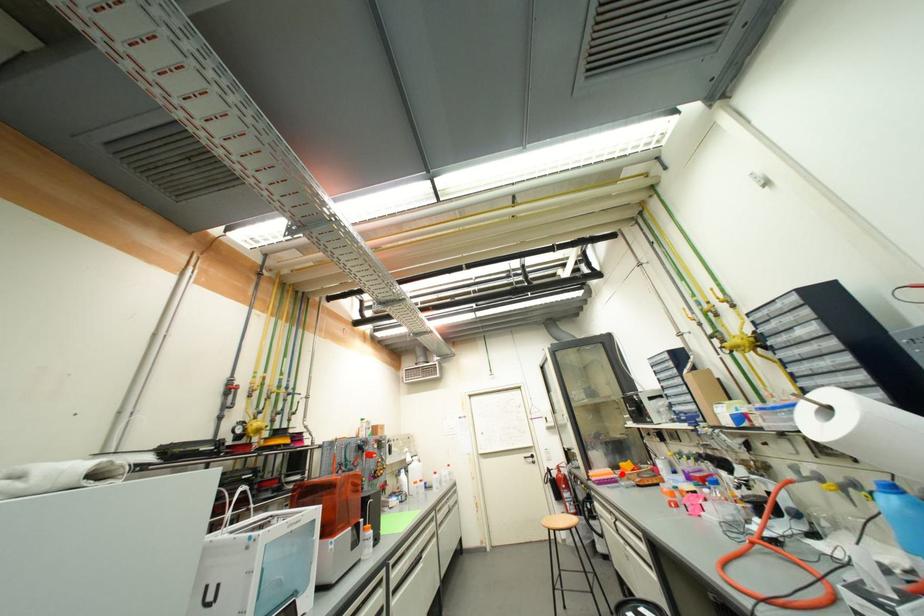
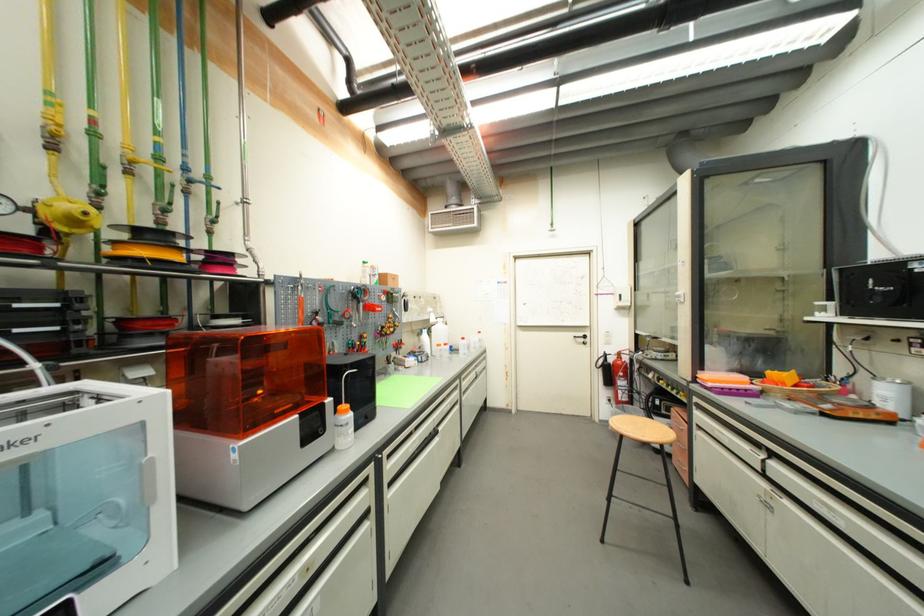
Question: I am providing you with two images of the same scene from different viewpoints. A red point is shown in image1. For the corresponding object point in image2, is it positioned nearer or farther from the camera?

Choices:
 (A) Nearer
 (B) Farther

Answer: (A)